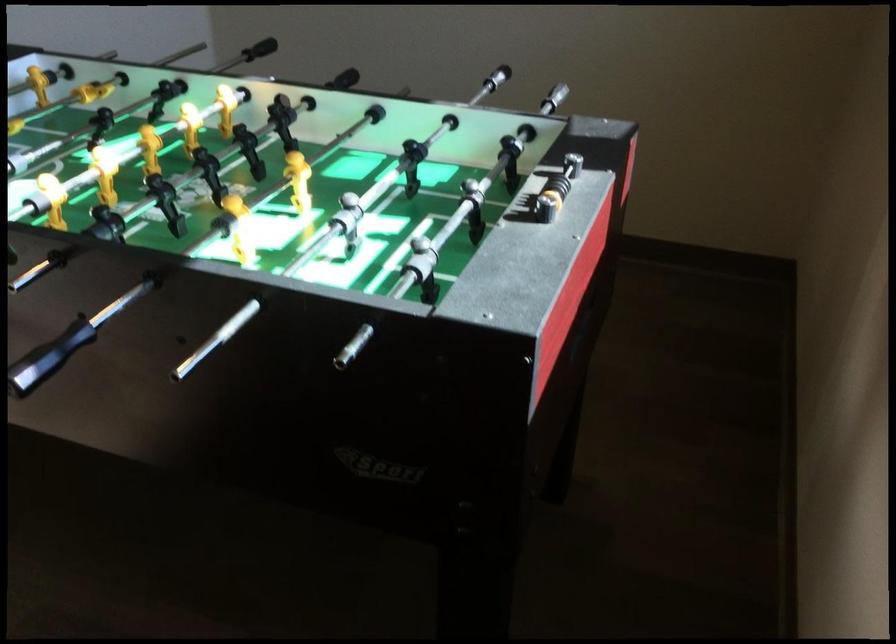
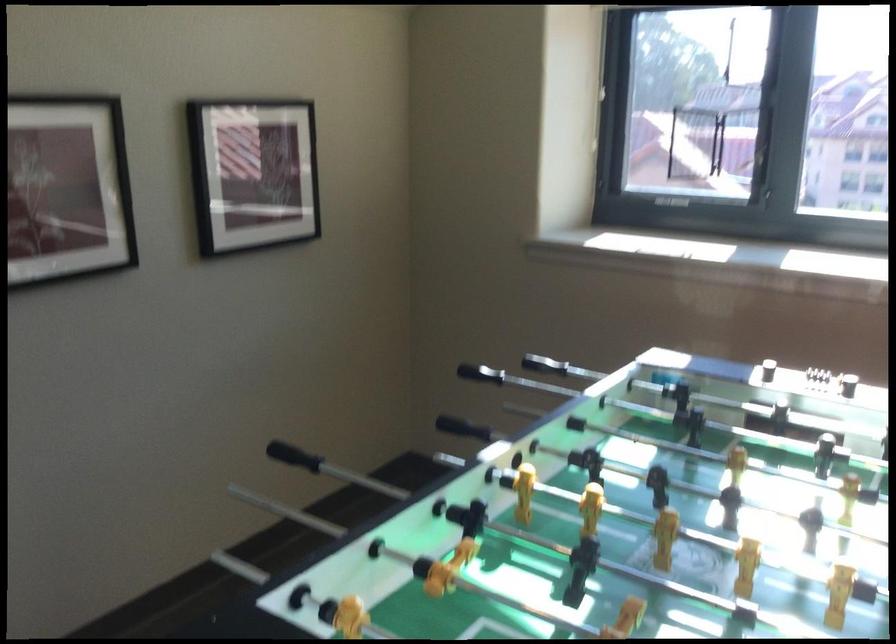
The point at (612, 167) is marked in the first image. Where is the corresponding point in the second image?

(294, 456)